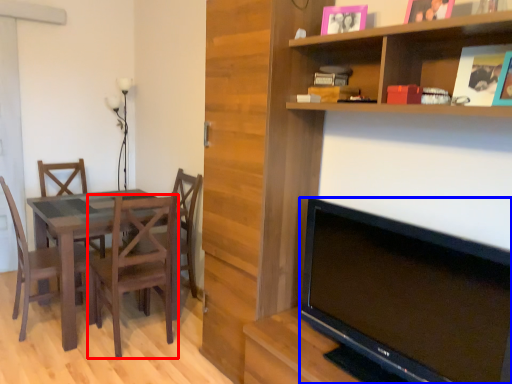
Question: Which object appears closest to the camera in this image, chair (highlighted by a red box) or television (highlighted by a blue box)?

Choices:
 (A) chair
 (B) television

Answer: (B)